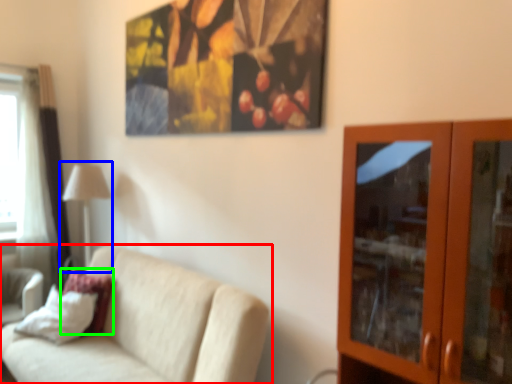
Question: Which object is the closest to the studio couch (highlighted by a red box)? Choose among these: table lamp (highlighted by a blue box) or pillow (highlighted by a green box).

Choices:
 (A) table lamp
 (B) pillow

Answer: (B)